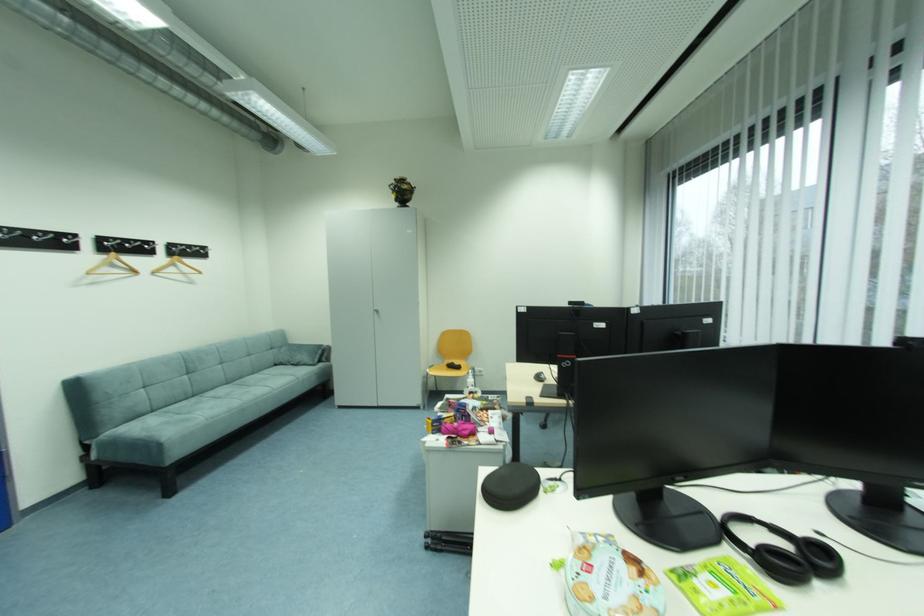
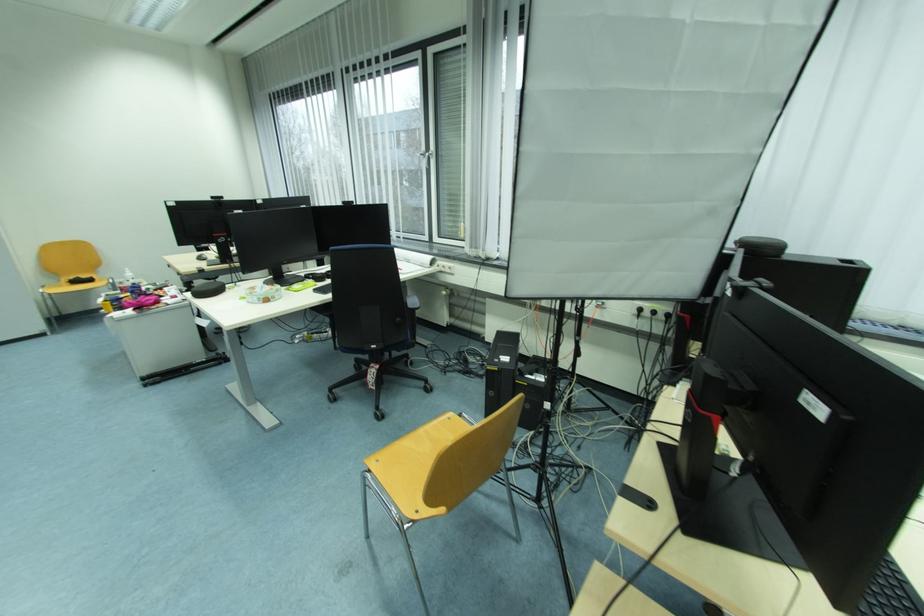
Find the pixel in the second image that matches point 487,373 in the first image.

(128, 284)